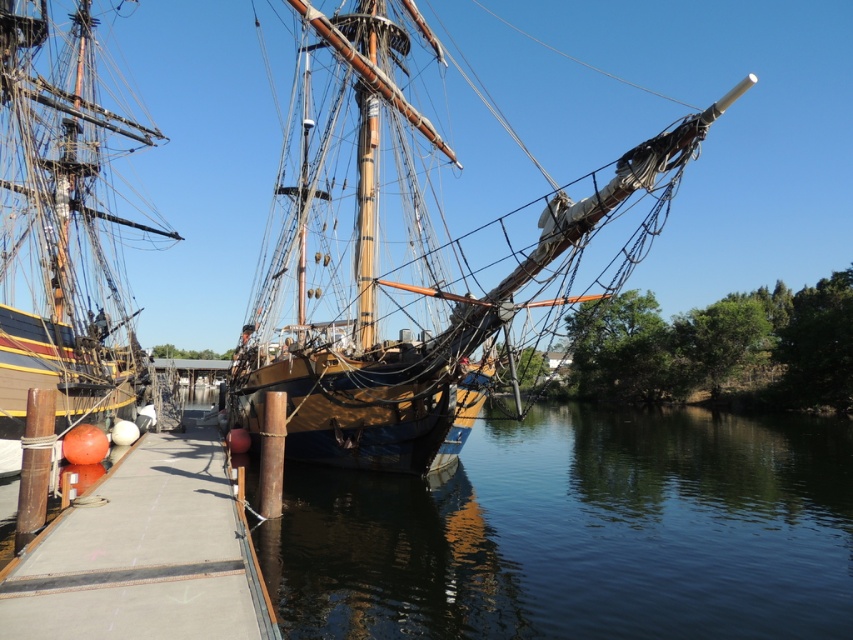
Which is more to the right, dark reflective water at center or wooden ship at left?

From the viewer's perspective, dark reflective water at center appears more on the right side.

Measure the distance between dark reflective water at center and camera.

dark reflective water at center is 10.16 meters from camera.

Is point (535, 460) behind point (26, 320)?

Yes, it is.

At what (x,y) coordinates should I click in order to perform the action: click on dark reflective water at center. Please return your answer as a coordinate pair (x, y). This screenshot has height=640, width=853. Looking at the image, I should click on (579, 532).

Who is more distant from viewer, (602, 508) or (90, 576)?

The point (602, 508) is more distant.

Does point (380, 632) come behind point (260, 608)?

Yes, point (380, 632) is farther from viewer.

Which is behind, point (811, 636) or point (59, 570)?

Positioned behind is point (811, 636).

Where is `dark reflective water at center`? The height and width of the screenshot is (640, 853). dark reflective water at center is located at coordinates (579, 532).

Which is more to the left, wooden ship at center or concrete at center?

From the viewer's perspective, concrete at center appears more on the left side.

Is wooden ship at center positioned before concrete at center?

No, wooden ship at center is further to the viewer.

Consider the image. Who is more distant from viewer, (662, 195) or (44, 618)?

Positioned behind is point (662, 195).

Where is `wooden ship at center`? The image size is (853, 640). wooden ship at center is located at coordinates (413, 260).